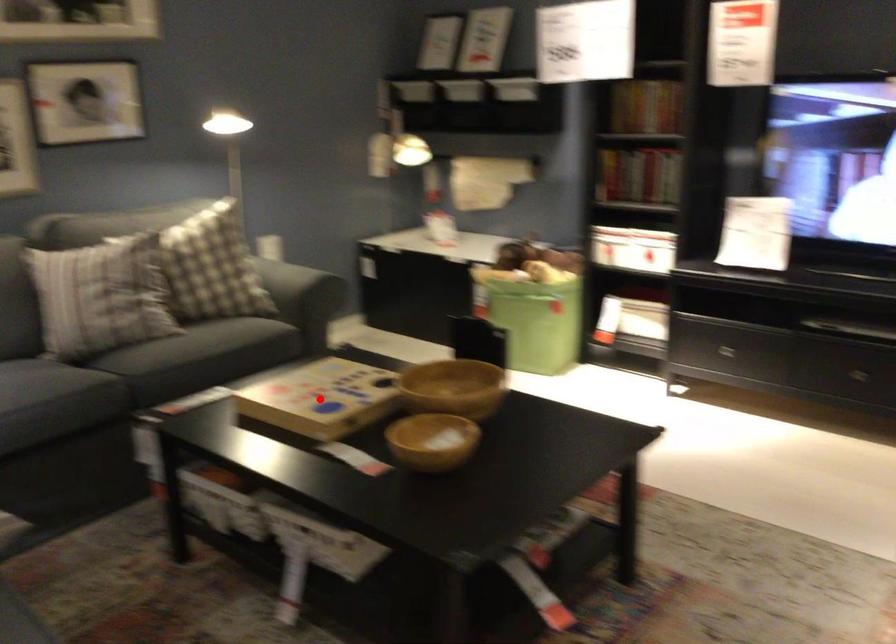
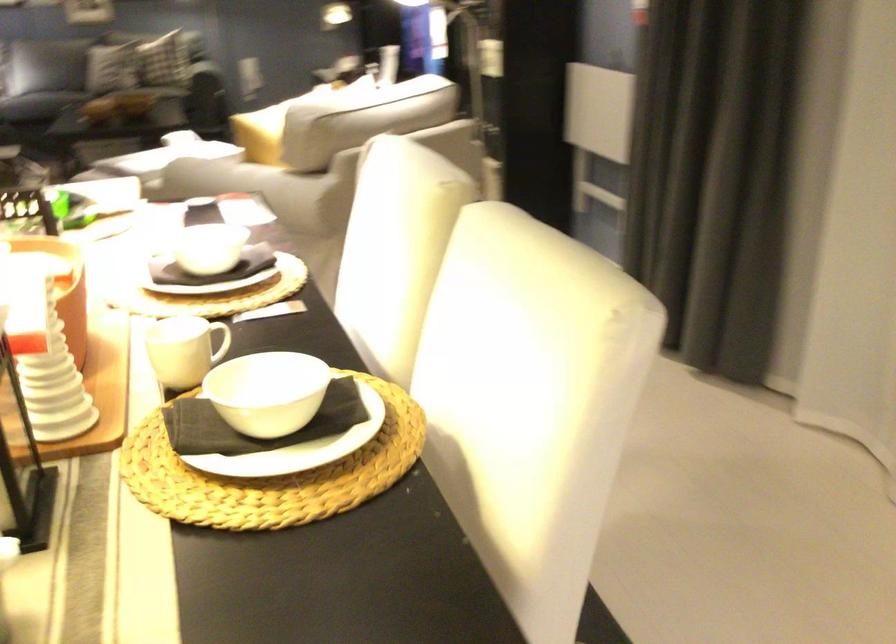
Question: I am providing you with two images of the same scene from different viewpoints. A red point is marked on the first image. At the location where the point appears in image 1, is it still visible in image 2?

Choices:
 (A) Yes
 (B) No

Answer: (B)